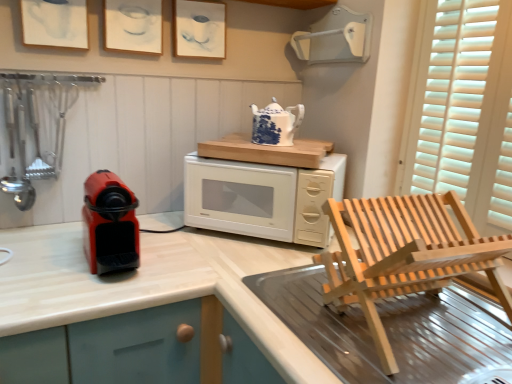
In order to face white paper at upper center, which appears as the 3th picture frame when viewed from the left, should I rotate leftwards or rightwards?

You should rotate left by 7.188 degrees.

In order to face natural wood chair at lower right, should I rotate leftwards or rightwards?

You should rotate right by 22.736 degrees.

Find the location of a particular element. This screenshot has width=512, height=384. white glossy microwave oven at center is located at coordinates (262, 198).

This screenshot has height=384, width=512. I want to click on matte plastic coffee machine at left, so click(x=110, y=224).

Based on the photo, how distant is white paper at upper center, which appears as the 3th picture frame when viewed from the left, from matte paper picture frame at upper center, the 2th picture frame positioned from the left?

The distance of white paper at upper center, which appears as the 3th picture frame when viewed from the left, from matte paper picture frame at upper center, the 2th picture frame positioned from the left, is 5.44 inches.

Does point (185, 19) lie in front of point (152, 40)?

That is False.

Considering the sizes of white paper at upper center, which appears as the 3th picture frame when viewed from the left, and matte paper picture frame at upper center, the 2th picture frame positioned from the left, in the image, is white paper at upper center, which appears as the 3th picture frame when viewed from the left, bigger or smaller than matte paper picture frame at upper center, the 2th picture frame positioned from the left,?

Considering their sizes, white paper at upper center, which appears as the 3th picture frame when viewed from the left, takes up more space than matte paper picture frame at upper center, the 2th picture frame positioned from the left.

Does white paper at upper center, which ranks as the first picture frame in right-to-left order, have a lesser width compared to matte paper picture frame at upper center, the 2th picture frame positioned from the left?

Incorrect, the width of white paper at upper center, which ranks as the first picture frame in right-to-left order, is not less than that of matte paper picture frame at upper center, the 2th picture frame positioned from the left.

Is matte paper picture frame at upper center, the 2th picture frame positioned from the left, located outside blue and white ceramic teapot at upper center?

Yes, matte paper picture frame at upper center, the 2th picture frame positioned from the left, is located beyond the bounds of blue and white ceramic teapot at upper center.

Would you consider matte paper picture frame at upper center, the 2th picture frame positioned from the left, to be distant from blue and white ceramic teapot at upper center?

No, there isn't a large distance between matte paper picture frame at upper center, the 2th picture frame positioned from the left, and blue and white ceramic teapot at upper center.

Is matte paper picture frame at upper center, which is the second picture frame in right-to-left order, facing away from blue and white ceramic teapot at upper center?

No.

From the image's perspective, would you say matte plastic coffee machine at left is shown under blue and white ceramic teapot at upper center?

Yes.

Is matte plastic coffee machine at left at the right side of blue and white ceramic teapot at upper center?

Incorrect, matte plastic coffee machine at left is not on the right side of blue and white ceramic teapot at upper center.

Would you consider matte plastic coffee machine at left to be distant from blue and white ceramic teapot at upper center?

No.

Would you say matte plastic coffee machine at left is outside blue and white ceramic teapot at upper center?

Yes, matte plastic coffee machine at left is outside of blue and white ceramic teapot at upper center.

Which of these two, matte plastic coffee machine at left or matte paper picture frame at upper left, arranged as the 1th picture frame when viewed from the left, stands taller?

matte plastic coffee machine at left is taller.

Can you confirm if matte plastic coffee machine at left is wider than matte paper picture frame at upper left, the third picture frame from the right?

Indeed, matte plastic coffee machine at left has a greater width compared to matte paper picture frame at upper left, the third picture frame from the right.

Does matte plastic coffee machine at left appear on the left side of matte paper picture frame at upper left, the third picture frame from the right?

No.

From a real-world perspective, which is physically above, blue and white ceramic teapot at upper center or white paper at upper center, which ranks as the first picture frame in right-to-left order?

In real-world perspective, white paper at upper center, which ranks as the first picture frame in right-to-left order, is above.

Can white paper at upper center, which appears as the 3th picture frame when viewed from the left, be found inside blue and white ceramic teapot at upper center?

That's incorrect, white paper at upper center, which appears as the 3th picture frame when viewed from the left, is not inside blue and white ceramic teapot at upper center.

You are a GUI agent. You are given a task and a screenshot of the screen. Output one action in this format:
    pyautogui.click(x=<x>, y=<y>)
    Task: Click on the kitchen appliance below the white paper at upper center, which ranks as the first picture frame in right-to-left order (from a real-world perspective)
    The height and width of the screenshot is (384, 512).
    Given the screenshot: What is the action you would take?
    pyautogui.click(x=275, y=124)

Which of these two, blue and white ceramic teapot at upper center or white paper at upper center, which appears as the 3th picture frame when viewed from the left, stands shorter?

blue and white ceramic teapot at upper center.

Is point (60, 37) positioned before point (176, 29)?

Yes, it is in front of point (176, 29).

How many degrees apart are the facing directions of matte paper picture frame at upper left, arranged as the 1th picture frame when viewed from the left, and white paper at upper center, which appears as the 3th picture frame when viewed from the left?

The angle between the facing direction of matte paper picture frame at upper left, arranged as the 1th picture frame when viewed from the left, and the facing direction of white paper at upper center, which appears as the 3th picture frame when viewed from the left, is 0.656 degrees.

Is matte paper picture frame at upper left, the third picture frame from the right, to the left or to the right of white paper at upper center, which ranks as the first picture frame in right-to-left order, in the image?

In the image, matte paper picture frame at upper left, the third picture frame from the right, appears on the left side of white paper at upper center, which ranks as the first picture frame in right-to-left order.

Are matte paper picture frame at upper left, the third picture frame from the right, and white paper at upper center, which ranks as the first picture frame in right-to-left order, far apart?

No, matte paper picture frame at upper left, the third picture frame from the right, is not far away from white paper at upper center, which ranks as the first picture frame in right-to-left order.

Which of these two, matte paper picture frame at upper left, the third picture frame from the right, or matte plastic coffee machine at left, stands taller?

With more height is matte plastic coffee machine at left.

Is matte plastic coffee machine at left completely or partially inside matte paper picture frame at upper left, arranged as the 1th picture frame when viewed from the left?

Definitely not — matte plastic coffee machine at left is not inside matte paper picture frame at upper left, arranged as the 1th picture frame when viewed from the left.

Is matte paper picture frame at upper left, arranged as the 1th picture frame when viewed from the left, not close to matte plastic coffee machine at left?

Actually, matte paper picture frame at upper left, arranged as the 1th picture frame when viewed from the left, and matte plastic coffee machine at left are a little close together.

At what (x,y) coordinates should I click in order to perform the action: click on picture frame that appears on the right of matte paper picture frame at upper center, the 2th picture frame positioned from the left. Please return your answer as a coordinate pair (x, y). The height and width of the screenshot is (384, 512). Looking at the image, I should click on (199, 29).

The image size is (512, 384). In order to click on kitchen appliance below the matte paper picture frame at upper center, which is the second picture frame in right-to-left order (from a real-world perspective) in this screenshot , I will do 275,124.

From the image, which object appears to be farther from white paper at upper center, which ranks as the first picture frame in right-to-left order, matte paper picture frame at upper left, the third picture frame from the right, or blue and white ceramic teapot at upper center?

Among the two, matte paper picture frame at upper left, the third picture frame from the right, is located further to white paper at upper center, which ranks as the first picture frame in right-to-left order.

Considering their positions, is white glossy microwave oven at center positioned closer to blue and white ceramic teapot at upper center than natural wood chair at lower right?

Among the two, white glossy microwave oven at center is located nearer to blue and white ceramic teapot at upper center.

From the image, which object appears to be farther from white glossy microwave oven at center, matte paper picture frame at upper center, which is the second picture frame in right-to-left order, or blue and white ceramic teapot at upper center?

matte paper picture frame at upper center, which is the second picture frame in right-to-left order, is positioned further to the anchor white glossy microwave oven at center.

Estimate the real-world distances between objects in this image. Which object is closer to matte plastic coffee machine at left, white glossy microwave oven at center or matte paper picture frame at upper center, which is the second picture frame in right-to-left order?

white glossy microwave oven at center is closer to matte plastic coffee machine at left.

Estimate the real-world distances between objects in this image. Which object is closer to matte plastic coffee machine at left, white glossy microwave oven at center or matte paper picture frame at upper left, arranged as the 1th picture frame when viewed from the left?

white glossy microwave oven at center is closer to matte plastic coffee machine at left.

Considering their positions, is blue and white ceramic teapot at upper center positioned further to white paper at upper center, which ranks as the first picture frame in right-to-left order, than white glossy microwave oven at center?

white glossy microwave oven at center lies further to white paper at upper center, which ranks as the first picture frame in right-to-left order, than the other object.

When comparing their distances from natural wood chair at lower right, does blue and white ceramic teapot at upper center or matte paper picture frame at upper left, the third picture frame from the right, seem closer?

The object closer to natural wood chair at lower right is blue and white ceramic teapot at upper center.

Which object lies nearer to the anchor point blue and white ceramic teapot at upper center, matte paper picture frame at upper center, which is the second picture frame in right-to-left order, or matte plastic coffee machine at left?

Among the two, matte paper picture frame at upper center, which is the second picture frame in right-to-left order, is located nearer to blue and white ceramic teapot at upper center.

You are a GUI agent. You are given a task and a screenshot of the screen. Output one action in this format:
    pyautogui.click(x=<x>, y=<y>)
    Task: Click on the microwave oven positioned between natural wood chair at lower right and blue and white ceramic teapot at upper center from near to far
    This screenshot has width=512, height=384.
    Given the screenshot: What is the action you would take?
    pyautogui.click(x=262, y=198)

Where is `kitchen appliance between matte paper picture frame at upper center, which is the second picture frame in right-to-left order, and matte plastic coffee machine at left from top to bottom`? The height and width of the screenshot is (384, 512). kitchen appliance between matte paper picture frame at upper center, which is the second picture frame in right-to-left order, and matte plastic coffee machine at left from top to bottom is located at coordinates (275, 124).

Image resolution: width=512 pixels, height=384 pixels. Identify the location of microwave oven located between matte paper picture frame at upper left, arranged as the 1th picture frame when viewed from the left, and blue and white ceramic teapot at upper center in the left-right direction. (262, 198).

Locate an element on the screen. home appliance between matte paper picture frame at upper center, which is the second picture frame in right-to-left order, and natural wood chair at lower right is located at coordinates (x=110, y=224).